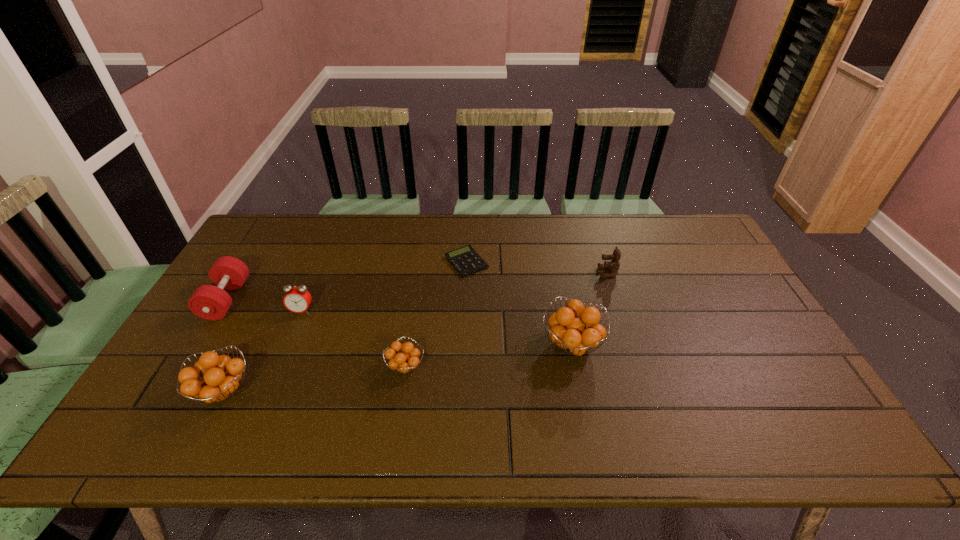
The image size is (960, 540). I want to click on orange fruit that is positioned at the left edge, so click(x=221, y=374).

Image resolution: width=960 pixels, height=540 pixels. Find the location of `dumbbell positioned at the left edge`. dumbbell positioned at the left edge is located at coordinates (209, 302).

You are a GUI agent. You are given a task and a screenshot of the screen. Output one action in this format:
    pyautogui.click(x=<x>, y=<y>)
    Task: Click on the object situated at the near left corner
    
    Given the screenshot: What is the action you would take?
    pyautogui.click(x=221, y=374)

Where is `free space at the far edge of the desktop`? free space at the far edge of the desktop is located at coordinates (332, 232).

This screenshot has width=960, height=540. I want to click on vacant point at the left edge, so click(227, 346).

Image resolution: width=960 pixels, height=540 pixels. In the image, there is a desktop. Identify the location of vacant space at the right edge. (709, 302).

Where is `free region at the far right corner of the desktop`? free region at the far right corner of the desktop is located at coordinates (677, 225).

Where is `free space between the leftmost orange fruit and the shortest orange fruit`? This screenshot has width=960, height=540. free space between the leftmost orange fruit and the shortest orange fruit is located at coordinates (315, 379).

The width and height of the screenshot is (960, 540). I want to click on free spot between the teddy bear and the fourth object from left to right, so click(x=507, y=320).

The image size is (960, 540). I want to click on free spot between the sixth tallest object and the leftmost orange fruit, so click(315, 379).